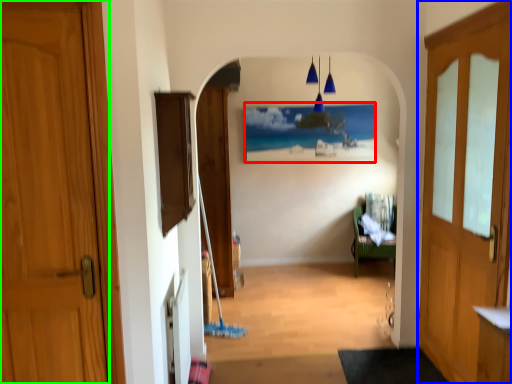
Question: Which object is the farthest from picture frame (highlighted by a red box)? Choose among these: door (highlighted by a blue box) or door (highlighted by a green box).

Choices:
 (A) door
 (B) door

Answer: (B)